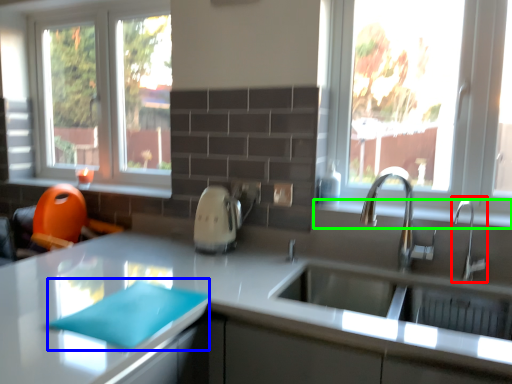
Question: Based on their relative distances, which object is farther from tap (highlighted by a red box)? Choose from place mat (highlighted by a blue box) and window sill (highlighted by a green box).

Choices:
 (A) place mat
 (B) window sill

Answer: (A)